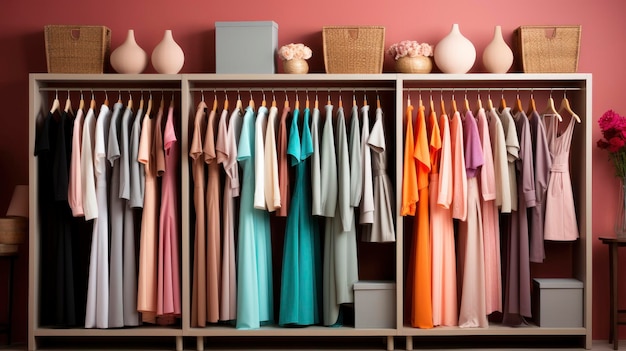
This screenshot has height=351, width=626. Identify the location of flowers and flower baskets. (293, 50), (404, 50), (297, 67), (414, 61).